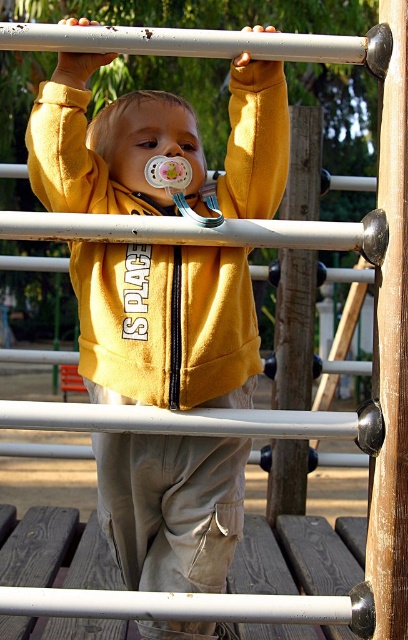
Question: Which of the following is the closest to the observer?

Choices:
 (A) yellow fleece sweatshirt at center
 (B) brown wooden pole at center-right

Answer: (B)

Question: Which object is closer to the camera taking this photo?

Choices:
 (A) brown wooden pole at center-right
 (B) yellow fleece sweatshirt at center

Answer: (A)

Question: Does yellow fleece sweatshirt at center have a greater width compared to brown wooden pole at center-right?

Choices:
 (A) no
 (B) yes

Answer: (B)

Question: Is the position of yellow fleece sweatshirt at center less distant than that of brown wooden pole at center-right?

Choices:
 (A) no
 (B) yes

Answer: (A)

Question: Is yellow fleece sweatshirt at center to the left of brown wooden pole at center-right from the viewer's perspective?

Choices:
 (A) no
 (B) yes

Answer: (B)